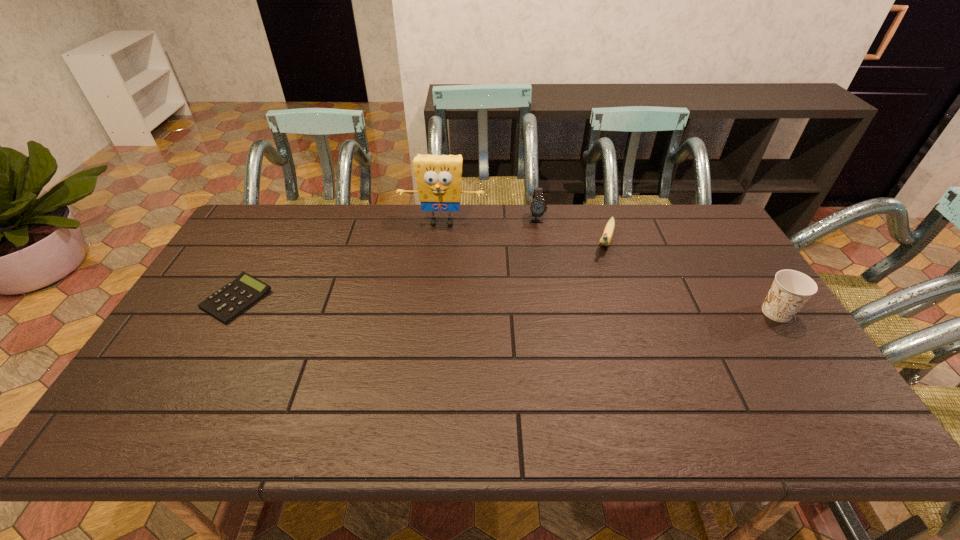
Locate an element on the screen. The width and height of the screenshot is (960, 540). vacant space positioned 0.130m at the stem of the second shortest object is located at coordinates (597, 284).

You are a GUI agent. You are given a task and a screenshot of the screen. Output one action in this format:
    pyautogui.click(x=<x>, y=<y>)
    Task: Click on the vacant position located at the stem of the second shortest object
    The width and height of the screenshot is (960, 540).
    Given the screenshot: What is the action you would take?
    pyautogui.click(x=587, y=316)

The width and height of the screenshot is (960, 540). I want to click on vacant space located at the stem of the second shortest object, so click(x=577, y=345).

Image resolution: width=960 pixels, height=540 pixels. What are the coordinates of `free space located 0.370m on the face of the sponge` in the screenshot? It's located at (427, 314).

What are the coordinates of `vacant space located on the face of the sponge` in the screenshot? It's located at (431, 288).

At what (x,y) coordinates should I click in order to perform the action: click on free location located 0.330m on the face of the sponge. Please return your answer as a coordinate pair (x, y). Looking at the image, I should click on (428, 303).

You are a GUI agent. You are given a task and a screenshot of the screen. Output one action in this format:
    pyautogui.click(x=<x>, y=<y>)
    Task: Click on the vacant space located on the face of the watch
    
    Given the screenshot: What is the action you would take?
    pyautogui.click(x=539, y=249)

Where is `vacant space located on the face of the watch`? vacant space located on the face of the watch is located at coordinates (539, 255).

You are a GUI agent. You are given a task and a screenshot of the screen. Output one action in this format:
    pyautogui.click(x=<x>, y=<y>)
    Task: Click on the free spot located on the face of the watch
    This screenshot has width=960, height=540.
    Given the screenshot: What is the action you would take?
    pyautogui.click(x=538, y=246)

Find the location of `banana at the far edge`. banana at the far edge is located at coordinates (607, 235).